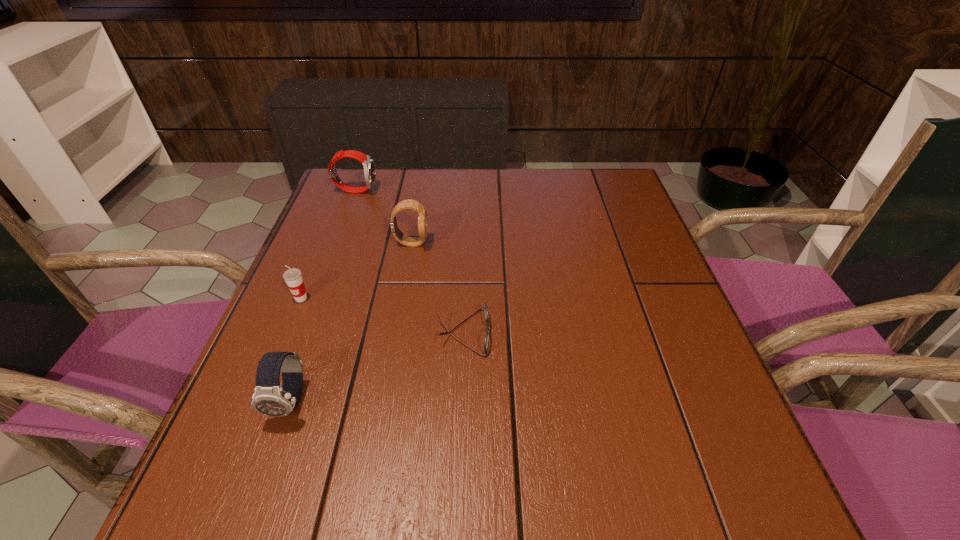
Locate an element on the screen. the farthest object is located at coordinates (368, 164).

Identify the location of the second farthest object. click(x=405, y=204).

Locate an element on the screen. The height and width of the screenshot is (540, 960). the rightmost watch is located at coordinates (405, 204).

Find the location of a particular element. Image resolution: width=960 pixels, height=540 pixels. the nearest watch is located at coordinates (269, 398).

Identify the location of cup. (293, 278).

You are a GUI agent. You are given a task and a screenshot of the screen. Output one action in this format:
    pyautogui.click(x=<x>, y=<y>)
    Task: Click on the third farthest object
    The height and width of the screenshot is (540, 960).
    Given the screenshot: What is the action you would take?
    pyautogui.click(x=293, y=278)

You are a GUI agent. You are given a task and a screenshot of the screen. Output one action in this format:
    pyautogui.click(x=<x>, y=<y>)
    Task: Click on the spectacles
    This screenshot has width=960, height=540.
    Given the screenshot: What is the action you would take?
    pyautogui.click(x=486, y=341)

Find the location of a particular element. The image size is (960, 540). the shortest object is located at coordinates (486, 341).

Where is `vacant space located on the face of the farthest object`? The width and height of the screenshot is (960, 540). vacant space located on the face of the farthest object is located at coordinates (461, 190).

I want to click on free space located 0.260m on the face of the second farthest object, so click(534, 243).